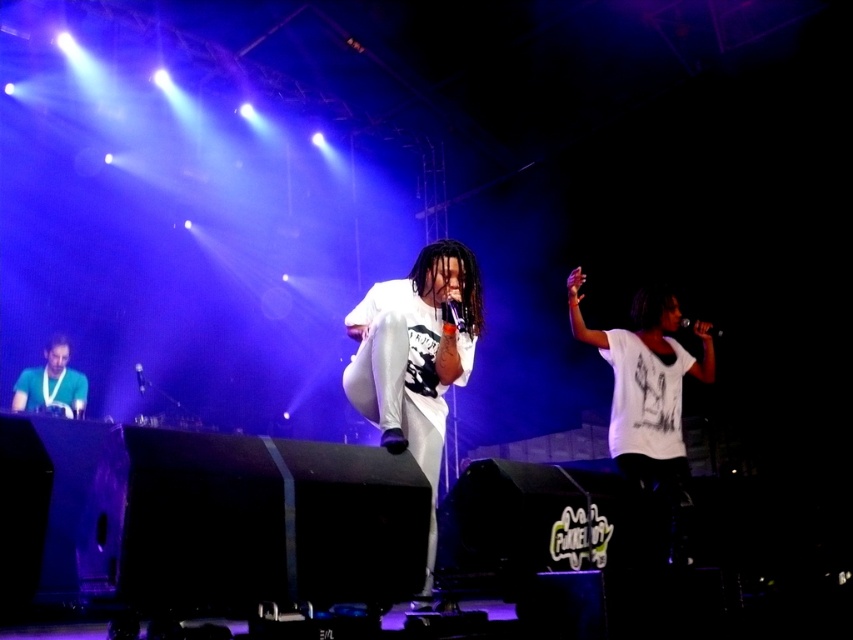
Question: Can you confirm if white matte t-shirt at center is smaller than green matte shirt at lower left?

Choices:
 (A) no
 (B) yes

Answer: (A)

Question: Which object is positioned closest to the white matte t-shirt at center?

Choices:
 (A) matte black microphone at center
 (B) black matte microphone at center
 (C) green matte shirt at lower left

Answer: (A)

Question: Which of the following is the farthest from the observer?

Choices:
 (A) white matte t-shirt at center
 (B) green matte shirt at lower left
 (C) matte black microphone at center

Answer: (B)

Question: Among these points, which one is farthest from the camera?

Choices:
 (A) (456, 301)
 (B) (685, 324)
 (C) (141, 385)
 (D) (73, 406)

Answer: (C)

Question: Does white matte t-shirt at center appear on the right side of matte black microphone at center?

Choices:
 (A) yes
 (B) no

Answer: (B)

Question: Can you confirm if metallic silver microphone at center is bigger than black matte microphone at center?

Choices:
 (A) yes
 (B) no

Answer: (A)